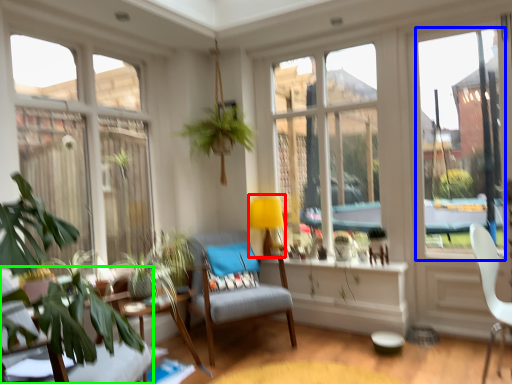
Question: Estimate the real-world distances between objects in this image. Which object is closer to lamp (highlighted by a red box), window screen (highlighted by a blue box) or chair (highlighted by a green box)?

Choices:
 (A) window screen
 (B) chair

Answer: (A)